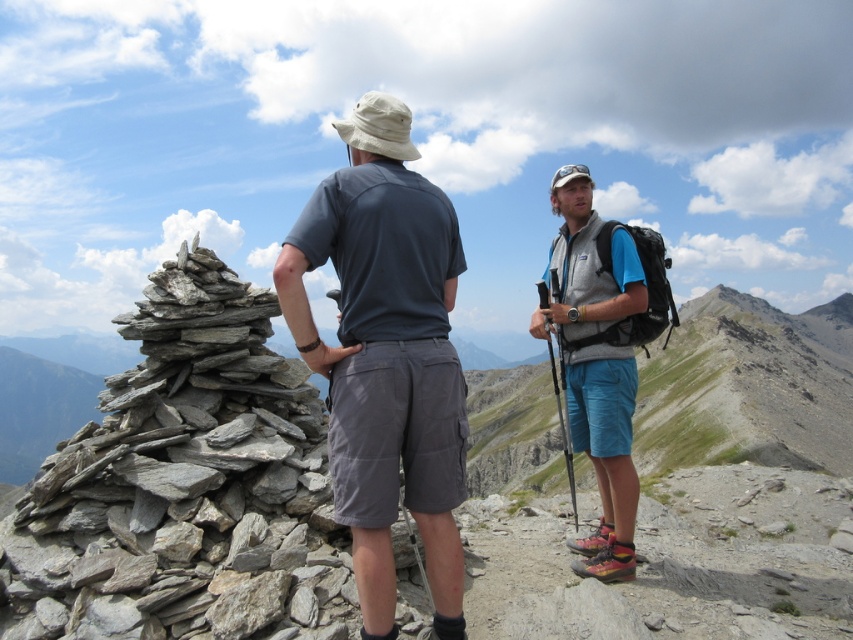
Between gray fabric shirt at center and matte gray vest at center, which one appears on the right side from the viewer's perspective?

From the viewer's perspective, matte gray vest at center appears more on the right side.

Which of these two, gray fabric shirt at center or matte gray vest at center, stands taller?

matte gray vest at center

Is point (374, 275) more distant than point (585, 256)?

That is False.

Locate an element on the screen. gray fabric shirt at center is located at coordinates (386, 355).

Does gray stone cairn at left lie behind gray fabric shirt at center?

Yes, it is.

Does gray stone cairn at left have a lesser width compared to gray fabric shirt at center?

No, gray stone cairn at left is not thinner than gray fabric shirt at center.

Is point (850, 614) positioned in front of point (292, 234)?

No.

Identify the location of gray stone cairn at left. This screenshot has width=853, height=640. (183, 525).

This screenshot has width=853, height=640. What do you see at coordinates (183, 525) in the screenshot? I see `gray stone cairn at left` at bounding box center [183, 525].

Between gray stone cairn at left and matte gray vest at center, which one appears on the left side from the viewer's perspective?

From the viewer's perspective, gray stone cairn at left appears more on the left side.

Locate an element on the screen. Image resolution: width=853 pixels, height=640 pixels. gray stone cairn at left is located at coordinates (183, 525).